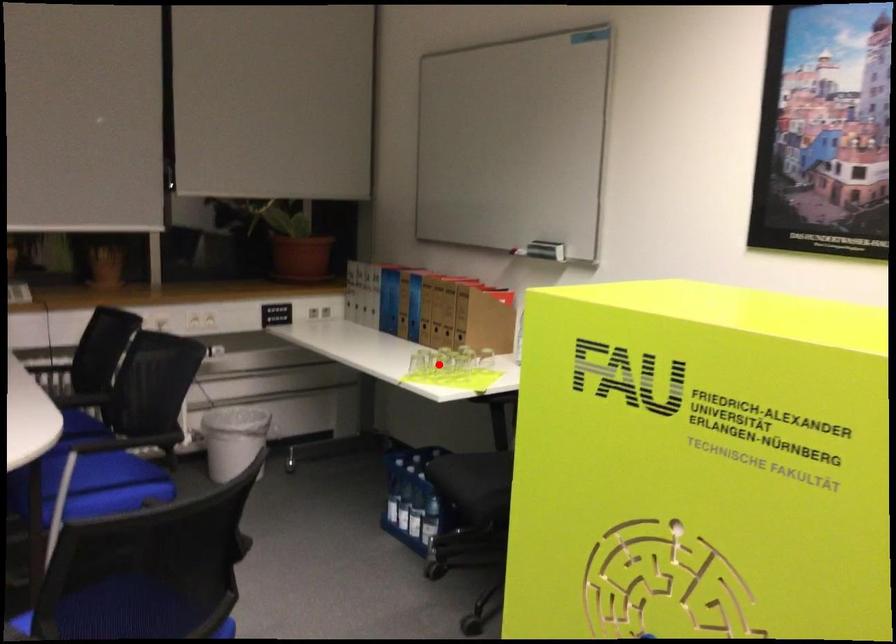
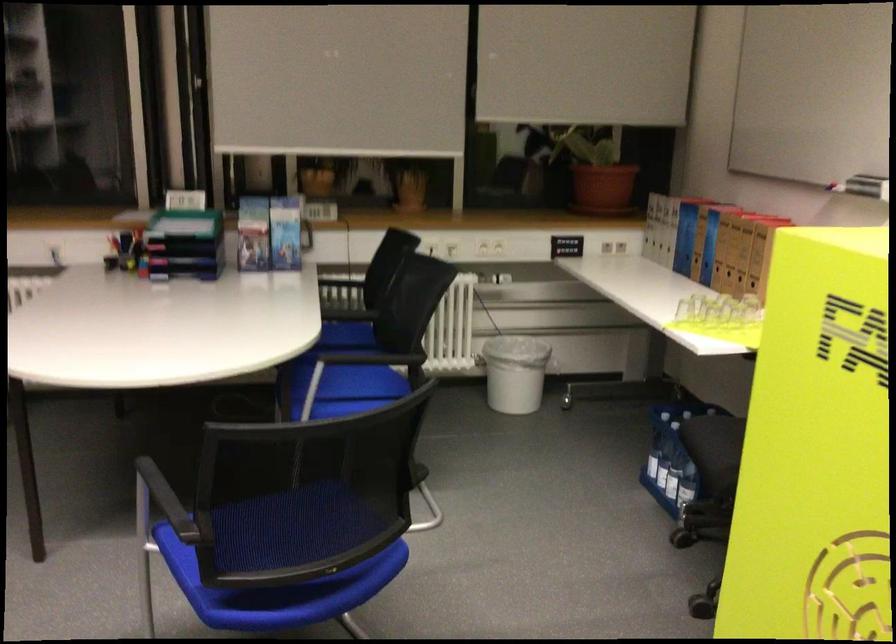
Question: A red point is marked in image1. In image2, is the corresponding 3D point closer to the camera or farther? Reply with the corresponding letter.

Choices:
 (A) The corresponding 3D point is closer.
 (B) The corresponding 3D point is farther.

Answer: (A)